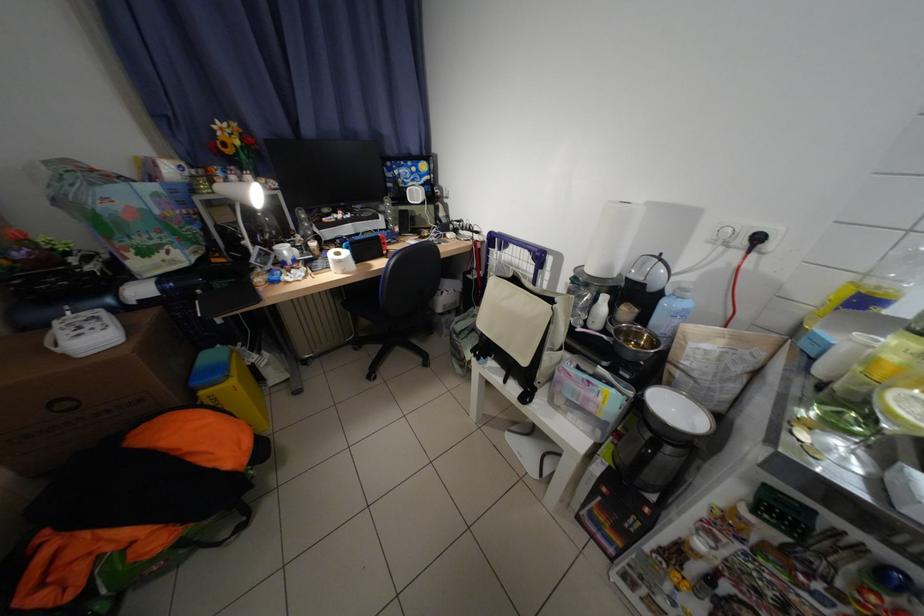
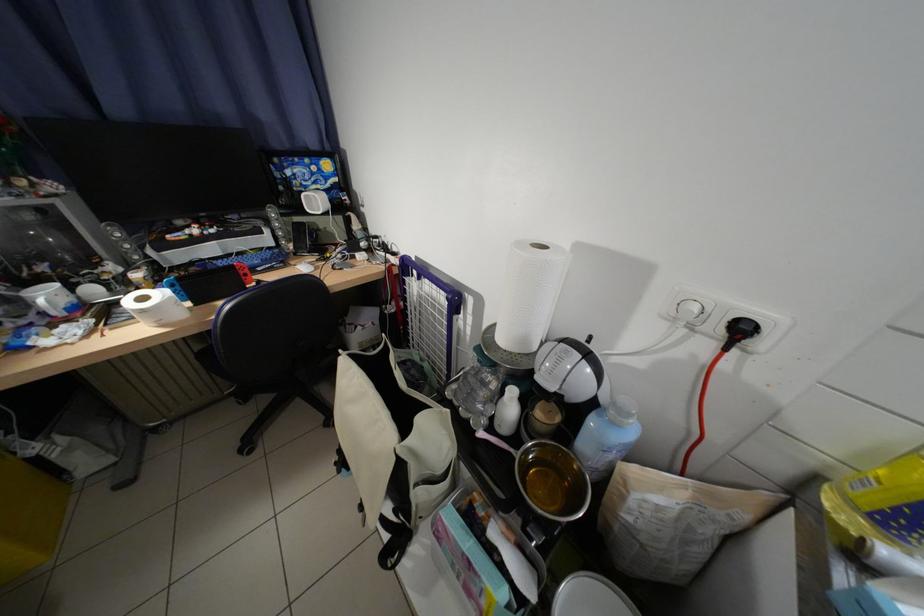
The point at (x=614, y=338) is marked in the first image. Where is the corresponding point in the second image?

(524, 453)